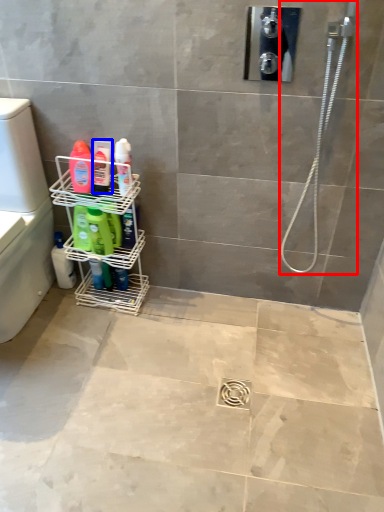
Question: Which object is further to the camera taking this photo, shower (highlighted by a red box) or toiletry (highlighted by a blue box)?

Choices:
 (A) shower
 (B) toiletry

Answer: (B)